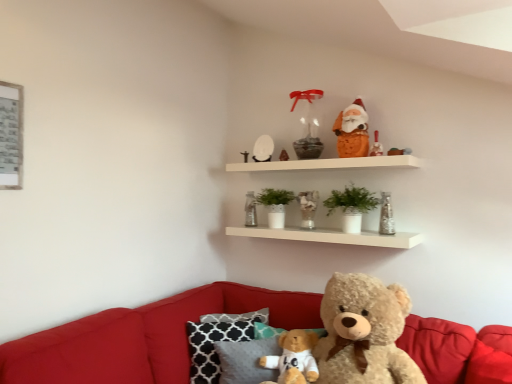
The height and width of the screenshot is (384, 512). Identify the location of vacant space positioned to the left of translucent glass candle at upper center, marked as the 6th toy in a left-to-right arrangement. (352, 153).